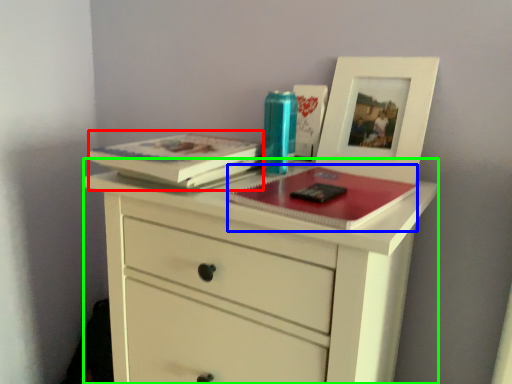
Question: Estimate the real-world distances between objects in this image. Which object is closer to paperback book (highlighted by a red box), magazine (highlighted by a blue box) or chest of drawers (highlighted by a green box)?

Choices:
 (A) magazine
 (B) chest of drawers

Answer: (A)